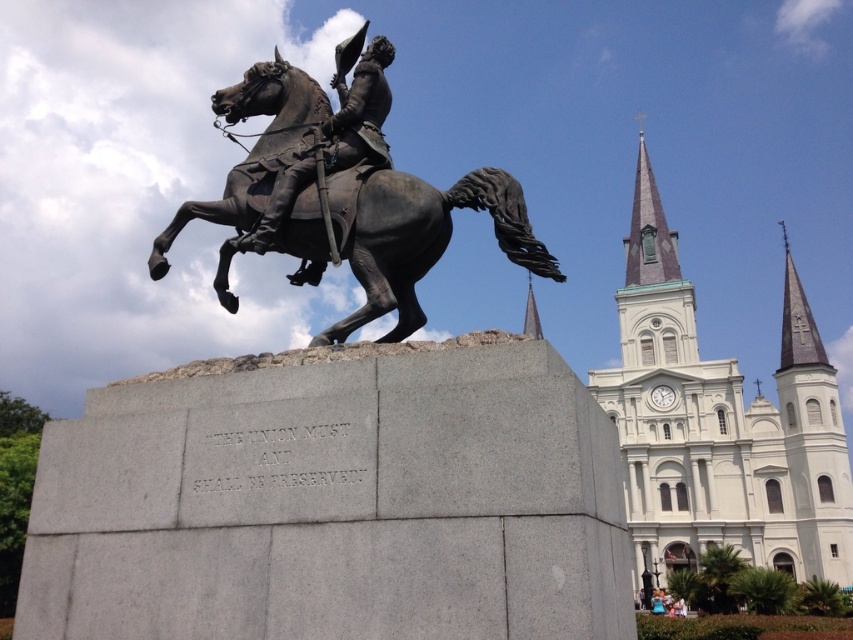
Does white stone church at upper right come behind bronze statue at center?

Yes, white stone church at upper right is further from the viewer.

Which is below, white stone church at upper right or bronze statue at center?

white stone church at upper right is lower down.

Where is `white stone church at upper right`? This screenshot has height=640, width=853. white stone church at upper right is located at coordinates (720, 424).

Who is more forward, [328,340] or [355,51]?

Point [328,340] is in front.

Is bronze/statue at center wider than bronze statue at center?

Indeed, bronze/statue at center has a greater width compared to bronze statue at center.

Locate an element on the screen. bronze/statue at center is located at coordinates (346, 196).

Does white stone church at upper right appear on the left side of bronze/statue at center?

In fact, white stone church at upper right is to the right of bronze/statue at center.

Who is shorter, white stone church at upper right or bronze/statue at center?

With less height is white stone church at upper right.

Describe the element at coordinates (720, 424) in the screenshot. This screenshot has width=853, height=640. I see `white stone church at upper right` at that location.

Locate an element on the screen. The height and width of the screenshot is (640, 853). white stone church at upper right is located at coordinates (720, 424).